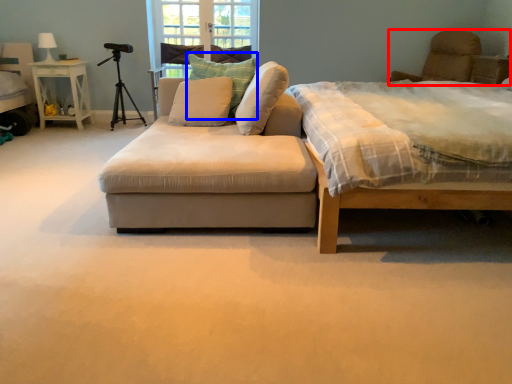
Question: Which object is further to the camera taking this photo, swivel chair (highlighted by a red box) or pillow (highlighted by a blue box)?

Choices:
 (A) swivel chair
 (B) pillow

Answer: (A)